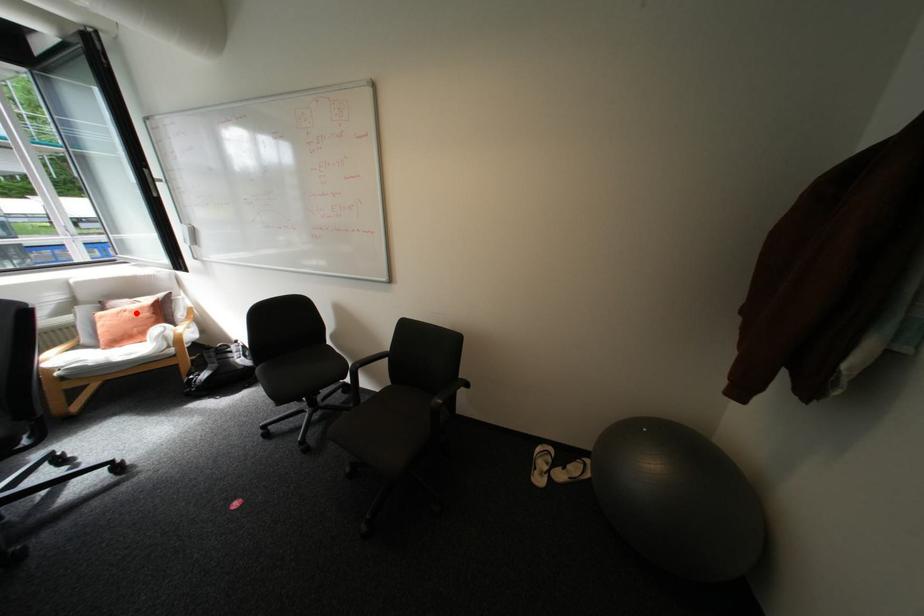
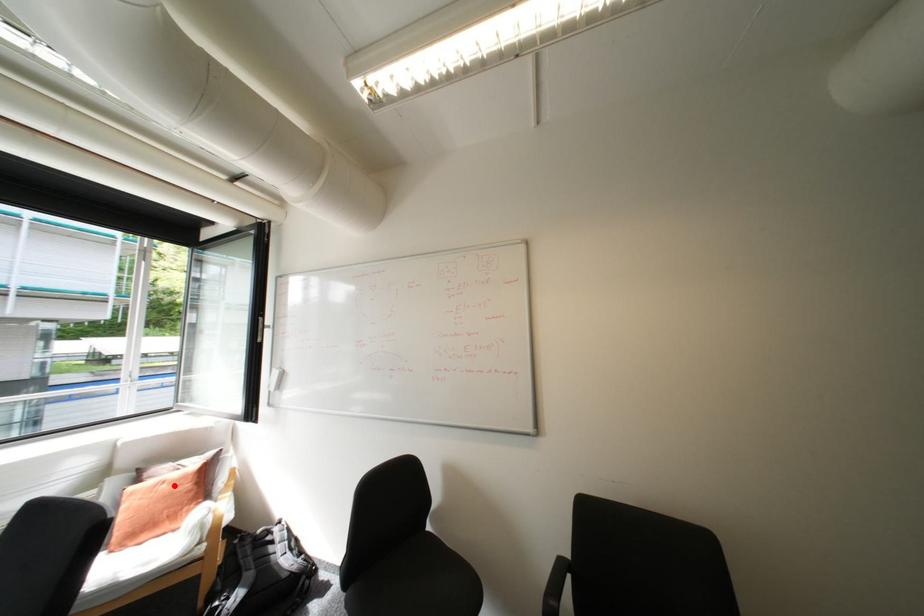
I am providing you with two images of the same scene from different viewpoints. A red point is marked on the first image and another point is marked on the second image. Does the point marked in image1 correspond to the same location as the one in image2?

Yes